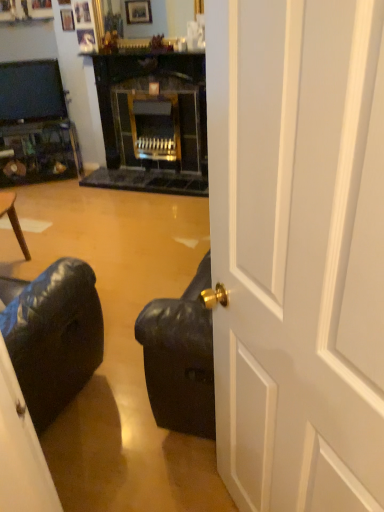
The height and width of the screenshot is (512, 384). Identify the location of matte black television at upper left. (31, 92).

Image resolution: width=384 pixels, height=512 pixels. Describe the element at coordinates (31, 92) in the screenshot. I see `matte black television at upper left` at that location.

Measure the distance between point (34, 90) and camera.

A distance of 13.39 feet exists between point (34, 90) and camera.

The width and height of the screenshot is (384, 512). What do you see at coordinates (298, 250) in the screenshot? I see `white glossy door at center` at bounding box center [298, 250].

Where is `white glossy door at center`? The width and height of the screenshot is (384, 512). white glossy door at center is located at coordinates (298, 250).

Image resolution: width=384 pixels, height=512 pixels. Identify the location of matte black television at upper left. (31, 92).

Between white glossy door at center and matte black television at upper left, which one appears on the right side from the viewer's perspective?

white glossy door at center is more to the right.

Considering the positions of objects white glossy door at center and matte black television at upper left in the image provided, who is behind, white glossy door at center or matte black television at upper left?

matte black television at upper left is further from the camera.

Which is in front, point (328, 20) or point (13, 62)?

Positioned in front is point (328, 20).

From the image's perspective, relative to matte black television at upper left, is white glossy door at center above or below?

Clearly, from the image's perspective, white glossy door at center is below matte black television at upper left.

From a real-world perspective, is white glossy door at center positioned under matte black television at upper left based on gravity?

Indeed, from a real-world perspective, white glossy door at center is positioned beneath matte black television at upper left.

Is white glossy door at center wider than matte black television at upper left?

Indeed, white glossy door at center has a greater width compared to matte black television at upper left.

In terms of height, does white glossy door at center look taller or shorter compared to matte black television at upper left?

In the image, white glossy door at center appears to be taller than matte black television at upper left.

Between white glossy door at center and matte black television at upper left, which one has larger size?

Bigger between the two is white glossy door at center.

Do you think white glossy door at center is within matte black television at upper left, or outside of it?

white glossy door at center is located beyond the bounds of matte black television at upper left.

Does white glossy door at center touch matte black television at upper left?

No, white glossy door at center is not beside matte black television at upper left.

Is white glossy door at center aimed at matte black television at upper left?

Yes, white glossy door at center is facing matte black television at upper left.

Looking at this image, measure the distance between white glossy door at center and matte black television at upper left.

white glossy door at center is 12.75 feet from matte black television at upper left.

In order to click on door on the right of the matte black television at upper left in this screenshot , I will do `click(298, 250)`.

Which is more to the left, matte black television at upper left or white glossy door at center?

matte black television at upper left.

Which object is closer to the camera taking this photo, matte black television at upper left or white glossy door at center?

white glossy door at center is closer to the camera.

Does point (10, 100) come closer to viewer compared to point (370, 323)?

No, it is behind (370, 323).

From the image's perspective, relative to white glossy door at center, is matte black television at upper left above or below?

Clearly, from the image's perspective, matte black television at upper left is above white glossy door at center.

From a real-world perspective, who is located lower, matte black television at upper left or white glossy door at center?

In real-world perspective, white glossy door at center is lower.

Does matte black television at upper left have a lesser width compared to white glossy door at center?

Indeed, matte black television at upper left has a lesser width compared to white glossy door at center.

Is matte black television at upper left taller or shorter than white glossy door at center?

matte black television at upper left is shorter than white glossy door at center.

Considering the sizes of objects matte black television at upper left and white glossy door at center in the image provided, who is smaller, matte black television at upper left or white glossy door at center?

Smaller between the two is matte black television at upper left.

Is matte black television at upper left completely or partially outside of white glossy door at center?

Indeed, matte black television at upper left is completely outside white glossy door at center.

Consider the image. Would you consider matte black television at upper left to be distant from white glossy door at center?

Yes, matte black television at upper left and white glossy door at center are quite far apart.

Is matte black television at upper left facing towards white glossy door at center?

Yes, matte black television at upper left is facing white glossy door at center.

In the image, there is a matte black television at upper left. Where is `door below it (from a real-world perspective)`? This screenshot has height=512, width=384. door below it (from a real-world perspective) is located at coordinates (298, 250).

Identify the location of door directly beneath the matte black television at upper left (from a real-world perspective). This screenshot has width=384, height=512. (298, 250).

In the image, there is a matte black television at upper left. Identify the location of door below it (from the image's perspective). 298,250.